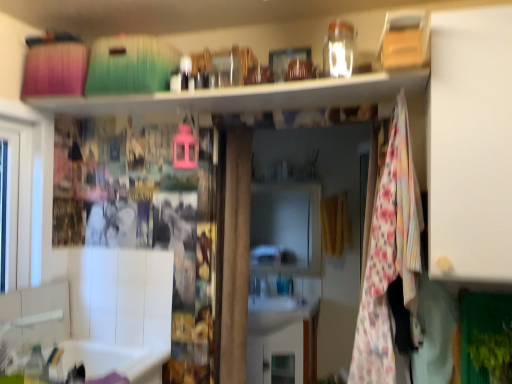
Question: Is white glossy cabinet at center in front of or behind floral fabric blanket at center-right in the image?

Choices:
 (A) front
 (B) behind

Answer: (B)

Question: Considering the positions of white glossy cabinet at center and floral fabric blanket at center-right in the image, is white glossy cabinet at center bigger or smaller than floral fabric blanket at center-right?

Choices:
 (A) big
 (B) small

Answer: (B)

Question: Considering the real-world distances, which object is farthest from the floral fabric blanket at center-right?

Choices:
 (A) white glossy cabinet at center
 (B) white matte cabinet at right

Answer: (A)

Question: Which of these objects is positioned farthest from the white matte cabinet at right?

Choices:
 (A) white glossy cabinet at center
 (B) floral fabric blanket at center-right

Answer: (A)